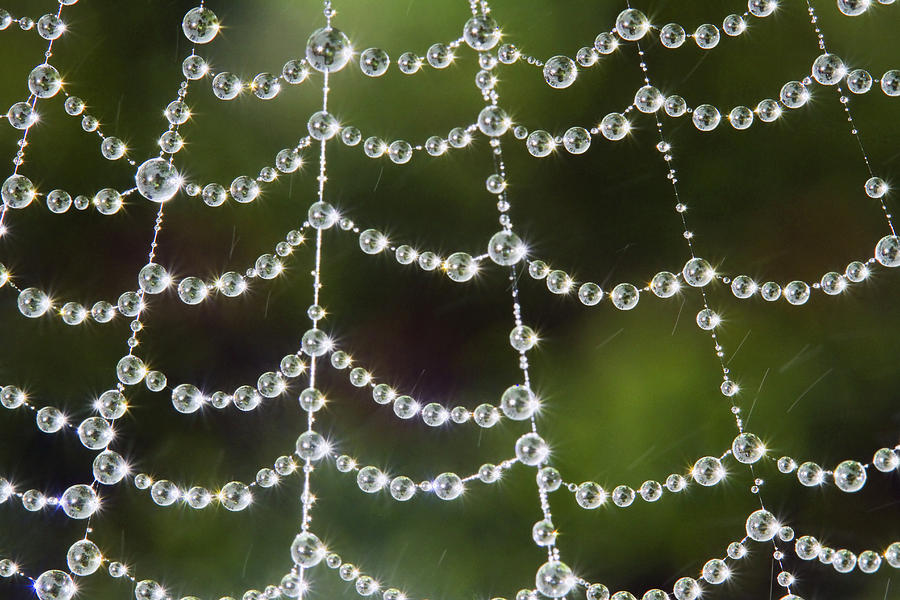
You are a GUI agent. You are given a task and a screenshot of the screen. Output one action in this format:
    pyautogui.click(x=<x>, y=<y>)
    Task: Click on the blank space under large bead
    
    Given the screenshot: What is the action you would take?
    pyautogui.click(x=97, y=576)